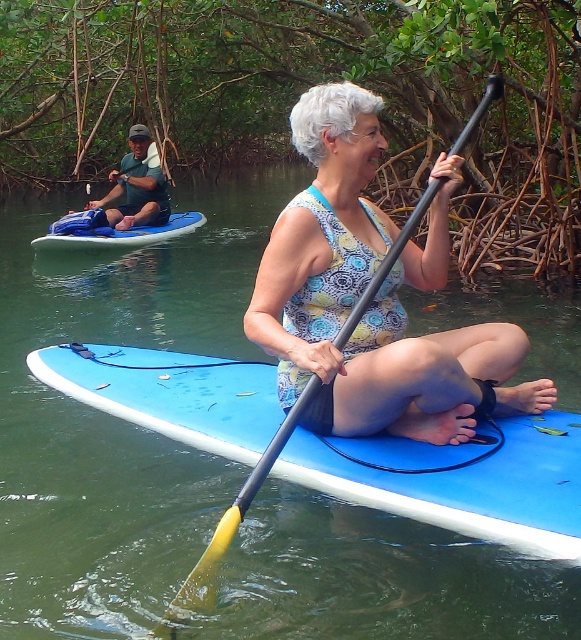
Question: Which point appears closest to the camera in this image?

Choices:
 (A) (443, 184)
 (B) (199, 422)
 (C) (166, 193)

Answer: (A)

Question: Which of the following is the farthest from the observer?

Choices:
 (A) click(x=284, y=435)
 (B) click(x=285, y=291)

Answer: (B)

Question: Is matte floral tank top at center positioned behind yellow rubber paddle at center?

Choices:
 (A) yes
 (B) no

Answer: (A)

Question: Can you confirm if matte floral tank top at center is positioned to the right of blue foam paddleboard at left?

Choices:
 (A) no
 (B) yes

Answer: (B)

Question: Among these objects, which one is farthest from the camera?

Choices:
 (A) dark green fabric shirt at upper left
 (B) yellow rubber paddle at center
 (C) blue foam paddleboard at center

Answer: (A)

Question: Does blue foam paddleboard at center have a larger size compared to dark green fabric shirt at upper left?

Choices:
 (A) yes
 (B) no

Answer: (B)